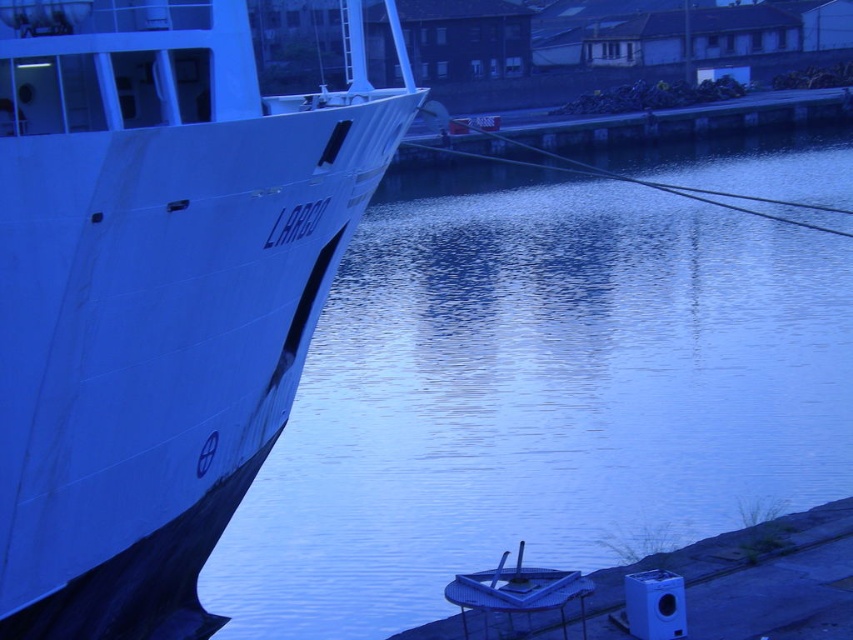
Question: Where is glossy water at center located in relation to white matte ship at left in the image?

Choices:
 (A) above
 (B) below

Answer: (B)

Question: Where is glossy water at center located in relation to white matte ship at left in the image?

Choices:
 (A) right
 (B) left

Answer: (A)

Question: Which of the following is the farthest from the observer?

Choices:
 (A) (428, 452)
 (B) (10, 556)

Answer: (A)

Question: Is glossy water at center behind white matte ship at left?

Choices:
 (A) no
 (B) yes

Answer: (B)

Question: Which of the following is the closest to the observer?

Choices:
 (A) (219, 388)
 (B) (672, 536)

Answer: (A)